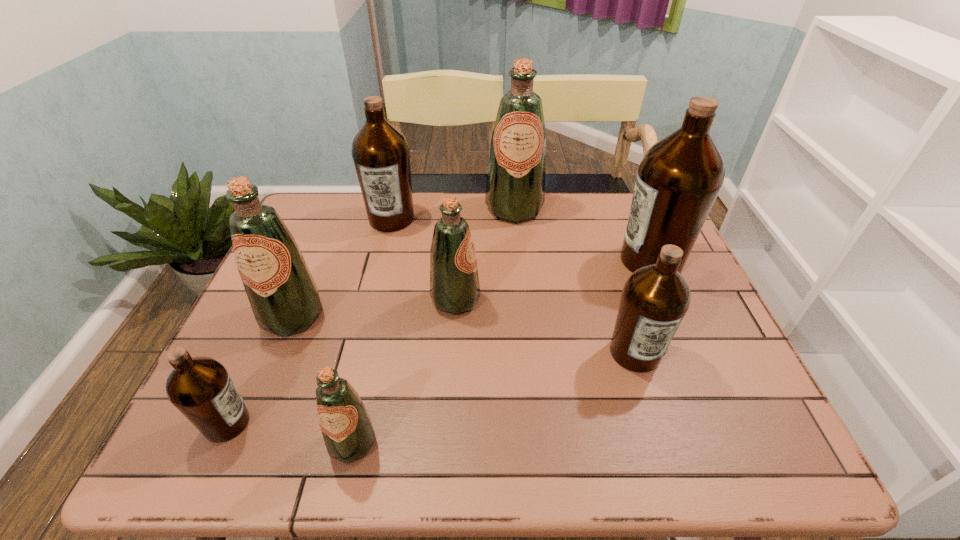
Image resolution: width=960 pixels, height=540 pixels. I want to click on free space between the smallest green olive oil and the farthest brown olive oil, so click(372, 330).

This screenshot has width=960, height=540. Identify the location of free spot between the third object from right to left and the second farthest brown olive oil. (583, 235).

Where is `vacant area between the nearest green olive oil and the nearest brown olive oil`? The width and height of the screenshot is (960, 540). vacant area between the nearest green olive oil and the nearest brown olive oil is located at coordinates (290, 433).

Locate an element on the screen. free space between the third biggest green olive oil and the second green olive oil from left to right is located at coordinates (404, 371).

This screenshot has width=960, height=540. In order to click on empty location between the second farthest brown olive oil and the nearest brown olive oil in this screenshot , I will do `click(439, 342)`.

I want to click on vacant point located between the leftmost green olive oil and the biggest green olive oil, so click(403, 262).

Find the location of a particular element. Image resolution: width=960 pixels, height=540 pixels. free space between the farthest green olive oil and the fifth object from left to right is located at coordinates (485, 254).

In order to click on vacant space that is in between the second nearest brown olive oil and the smallest brown olive oil in this screenshot , I will do `click(431, 388)`.

Locate which object is the closest to the smallest green olive oil. Please provide its 2D coordinates. Your answer should be formatted as a tuple, i.e. [(x, y)], where the tuple contains the x and y coordinates of a point satisfying the conditions above.

[(200, 388)]

Locate which object is the sixth closest to the second farthest brown olive oil. Please provide its 2D coordinates. Your answer should be formatted as a tuple, i.e. [(x, y)], where the tuple contains the x and y coordinates of a point satisfying the conditions above.

[(284, 298)]